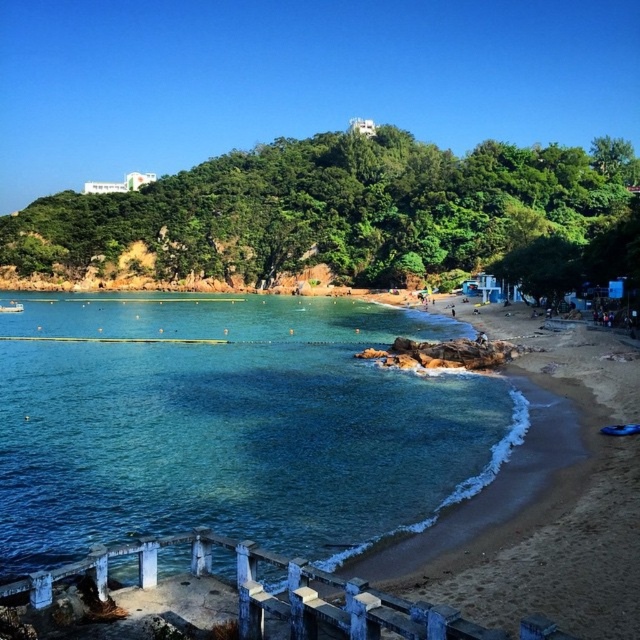
Between point (420, 422) and point (586, 529), which one is positioned in front?

Point (586, 529) is more forward.

Is point (422, 465) closer to camera compared to point (637, 394)?

Yes, point (422, 465) is closer to viewer.

This screenshot has width=640, height=640. I want to click on clear blue water at lower left, so click(x=230, y=426).